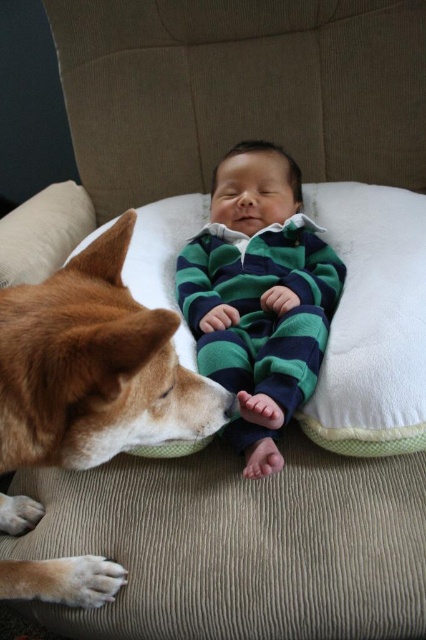
Question: Is brown fur dog at lower left behind green striped pajamas at center?

Choices:
 (A) no
 (B) yes

Answer: (A)

Question: Among these points, which one is farthest from the camera?

Choices:
 (A) (330, 292)
 (B) (52, 413)

Answer: (A)

Question: Is brown fur dog at lower left further to camera compared to green striped pajamas at center?

Choices:
 (A) yes
 (B) no

Answer: (B)

Question: Which of the following is the farthest from the observer?

Choices:
 (A) green striped pajamas at center
 (B) brown fur dog at lower left

Answer: (A)

Question: Does brown fur dog at lower left have a larger size compared to green striped pajamas at center?

Choices:
 (A) no
 (B) yes

Answer: (A)